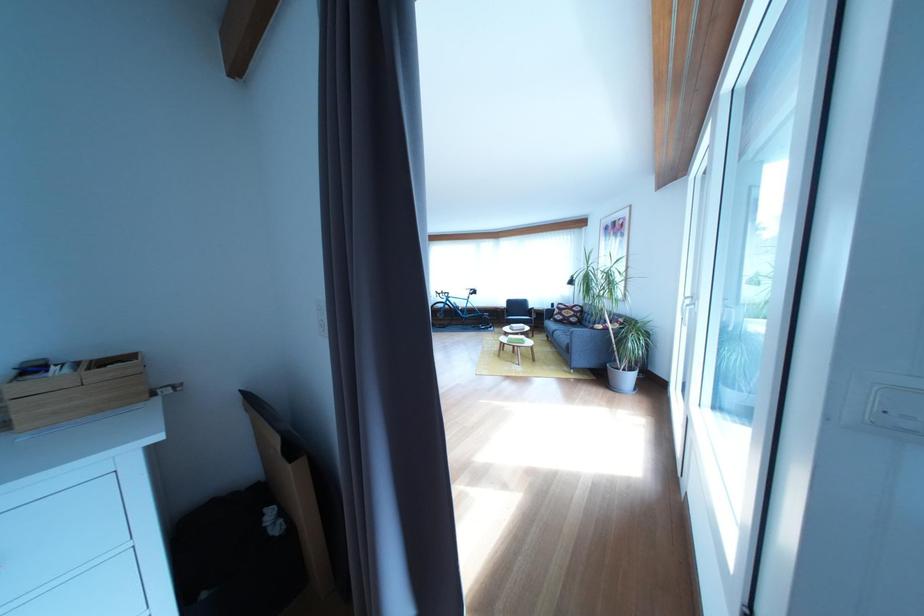
Locate an element on the screen. chair sitting surface is located at coordinates (518, 318).